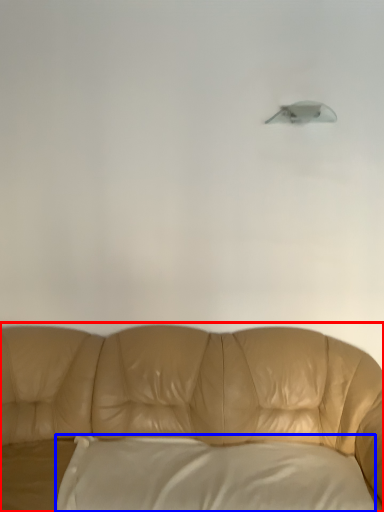
Question: Among these objects, which one is farthest to the camera, studio couch (highlighted by a red box) or pillow (highlighted by a blue box)?

Choices:
 (A) studio couch
 (B) pillow

Answer: (B)